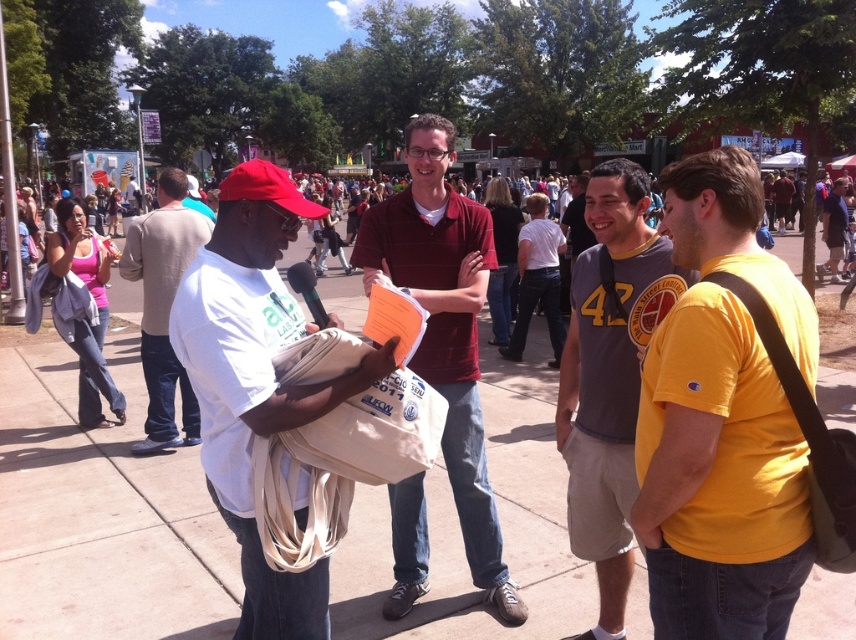
Who is taller, yellow cotton t-shirt at center or white cotton shirt at center?

With more height is white cotton shirt at center.

Does yellow cotton t-shirt at center have a lesser width compared to white cotton shirt at center?

Indeed, yellow cotton t-shirt at center has a lesser width compared to white cotton shirt at center.

The width and height of the screenshot is (856, 640). Describe the element at coordinates (722, 420) in the screenshot. I see `yellow cotton t-shirt at center` at that location.

The image size is (856, 640). Find the location of `yellow cotton t-shirt at center`. yellow cotton t-shirt at center is located at coordinates (722, 420).

At what (x,y) coordinates should I click in order to perform the action: click on white canvas bag at center. Please return your answer as a coordinate pair (x, y). Looking at the image, I should click on (256, 380).

Can you confirm if white canvas bag at center is positioned to the right of white cotton shirt at center?

Correct, you'll find white canvas bag at center to the right of white cotton shirt at center.

You are a GUI agent. You are given a task and a screenshot of the screen. Output one action in this format:
    pyautogui.click(x=<x>, y=<y>)
    Task: Click on the white canvas bag at center
    This screenshot has height=640, width=856.
    Given the screenshot: What is the action you would take?
    pyautogui.click(x=256, y=380)

Is white canvas bag at center bigger than yellow jersey at center?

No.

Describe the element at coordinates (256, 380) in the screenshot. I see `white canvas bag at center` at that location.

You are a GUI agent. You are given a task and a screenshot of the screen. Output one action in this format:
    pyautogui.click(x=<x>, y=<y>)
    Task: Click on the white canvas bag at center
    
    Given the screenshot: What is the action you would take?
    pyautogui.click(x=256, y=380)

The width and height of the screenshot is (856, 640). I want to click on white canvas bag at center, so click(256, 380).